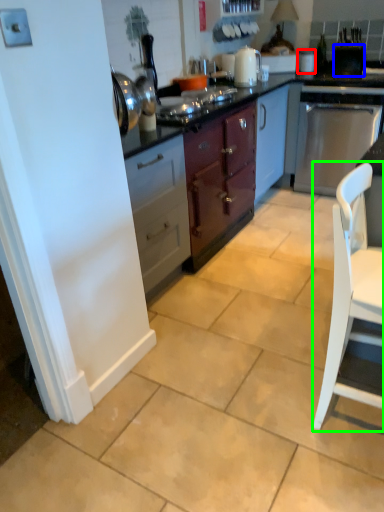
Question: Which object is positioned farthest from appliance (highlighted by a red box)? Select from appliance (highlighted by a blue box) and chair (highlighted by a green box).

Choices:
 (A) appliance
 (B) chair

Answer: (B)